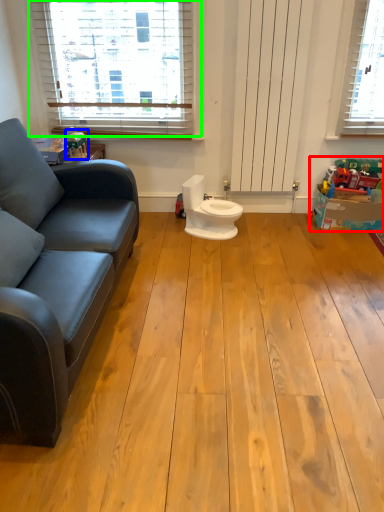
Question: Which object is the closest to the toy (highlighted by a red box)? Choose among these: toy (highlighted by a blue box) or window (highlighted by a green box).

Choices:
 (A) toy
 (B) window

Answer: (B)